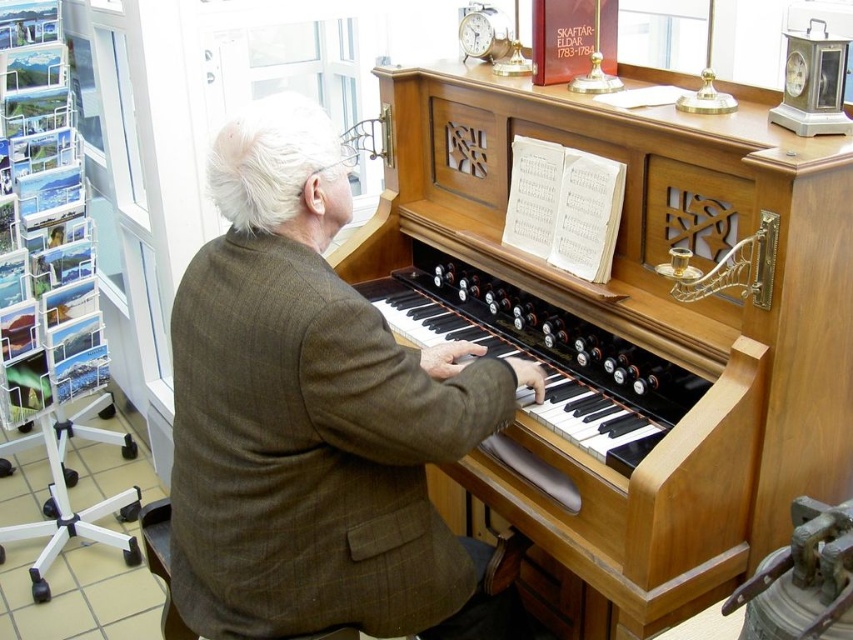
Question: Can you confirm if wooden piano at center is positioned below brown woolen suit at center?

Choices:
 (A) no
 (B) yes

Answer: (A)

Question: Among these points, which one is nearest to the camera?

Choices:
 (A) (614, 310)
 (B) (245, 481)

Answer: (B)

Question: Does wooden piano at center have a lesser width compared to brown woolen suit at center?

Choices:
 (A) no
 (B) yes

Answer: (A)

Question: Can you confirm if wooden piano at center is smaller than brown woolen suit at center?

Choices:
 (A) yes
 (B) no

Answer: (B)

Question: Which point is closer to the camera?

Choices:
 (A) pos(254,108)
 (B) pos(641,554)

Answer: (A)